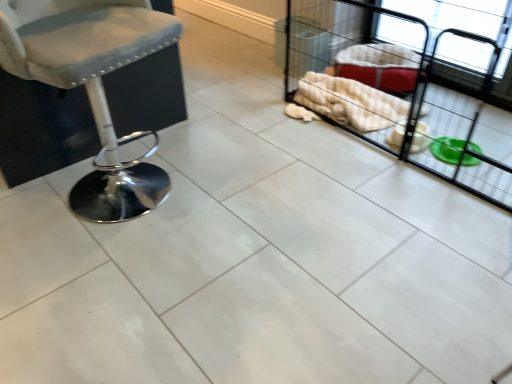
You are a GUI agent. You are given a task and a screenshot of the screen. Output one action in this format:
    pyautogui.click(x=<x>, y=<y>)
    Task: Click on the free space in front of white fabric baby carriage at right
    The height and width of the screenshot is (384, 512).
    Given the screenshot: What is the action you would take?
    352,270